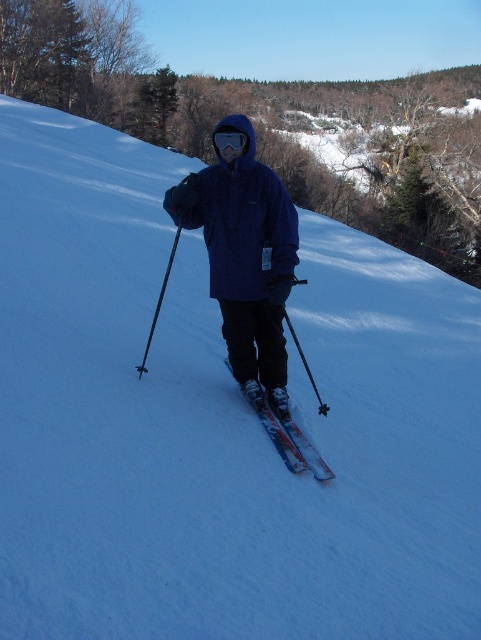
Does matte blue jacket at center appear over shiny metallic skis at center?

Correct, matte blue jacket at center is located above shiny metallic skis at center.

This screenshot has height=640, width=481. Describe the element at coordinates (244, 257) in the screenshot. I see `matte blue jacket at center` at that location.

Between point (164, 202) and point (260, 388), which one is positioned in front?

Point (164, 202)

What are the coordinates of `matte blue jacket at center` in the screenshot? It's located at (244, 257).